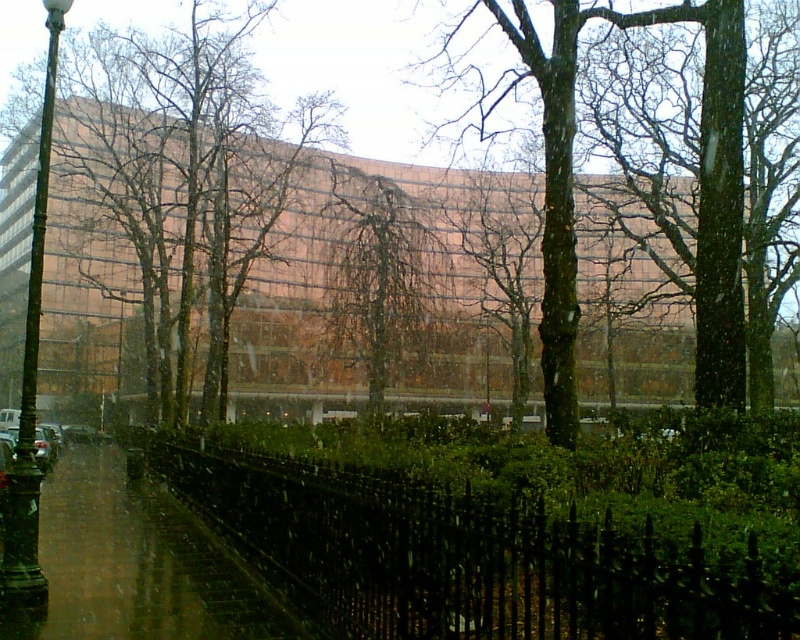
Is brown/glassy tree at center to the left of brown/mossy tree at center from the viewer's perspective?

Indeed, brown/glassy tree at center is positioned on the left side of brown/mossy tree at center.

Is brown/glassy tree at center above brown/mossy tree at center?

Yes.

Describe the element at coordinates (172, 189) in the screenshot. The width and height of the screenshot is (800, 640). I see `brown/glassy tree at center` at that location.

Locate an element on the screen. This screenshot has width=800, height=640. brown/glassy tree at center is located at coordinates (172, 189).

Does brown/glassy tree at center lie in front of brown smooth tree at center?

No, it is not.

Locate an element on the screen. This screenshot has width=800, height=640. brown/glassy tree at center is located at coordinates pos(172,189).

Does brown/mossy tree at center have a smaller size compared to green leafy tree at center?

Incorrect, brown/mossy tree at center is not smaller in size than green leafy tree at center.

Who is lower down, brown/mossy tree at center or green leafy tree at center?

green leafy tree at center

At what (x,y) coordinates should I click in order to perform the action: click on brown/mossy tree at center. Please return your answer as a coordinate pair (x, y). The height and width of the screenshot is (640, 800). Looking at the image, I should click on (698, 193).

Image resolution: width=800 pixels, height=640 pixels. I want to click on brown/mossy tree at center, so click(x=698, y=193).